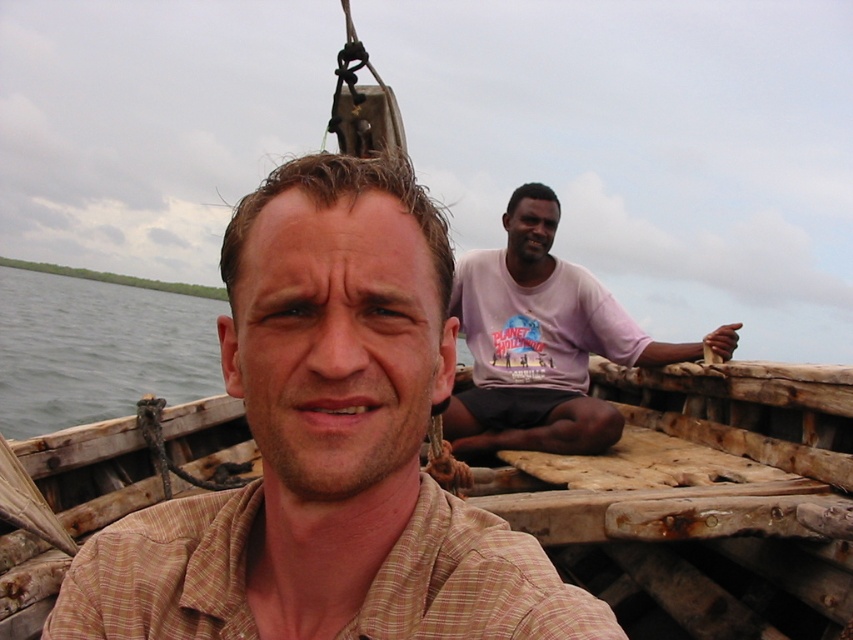
Who is lower down, light brown plaid shirt at center or weathered wood boat at center?

weathered wood boat at center is lower down.

Image resolution: width=853 pixels, height=640 pixels. Identify the location of light brown plaid shirt at center. (328, 449).

What are the coordinates of `light brown plaid shirt at center` in the screenshot? It's located at (328, 449).

Is light brown plaid shirt at center closer to the viewer compared to green water at left?

Yes, light brown plaid shirt at center is closer to the viewer.

Does light brown plaid shirt at center have a lesser width compared to green water at left?

Indeed, light brown plaid shirt at center has a lesser width compared to green water at left.

Image resolution: width=853 pixels, height=640 pixels. Describe the element at coordinates (328, 449) in the screenshot. I see `light brown plaid shirt at center` at that location.

Find the location of a particular element. This screenshot has height=640, width=853. light brown plaid shirt at center is located at coordinates (328, 449).

Which is more to the right, pink cotton shirt at upper right or green water at left?

Positioned to the right is pink cotton shirt at upper right.

Is pink cotton shirt at upper right positioned behind green water at left?

That is False.

Does point (573, 323) come closer to viewer compared to point (212, 342)?

That is True.

The width and height of the screenshot is (853, 640). Identify the location of pink cotton shirt at upper right. (538, 340).